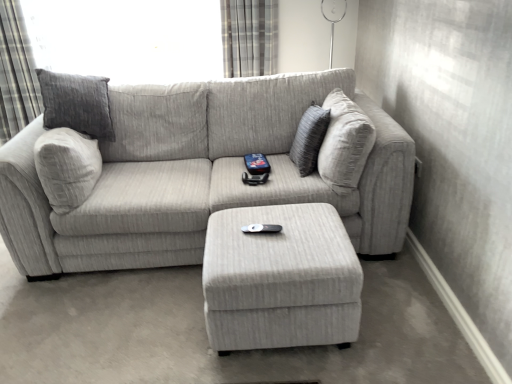
At what (x,y) coordinates should I click in order to perform the action: click on vacant location behind black plastic remote at center. Please return your answer as a coordinate pair (x, y). The height and width of the screenshot is (384, 512). Looking at the image, I should click on (264, 213).